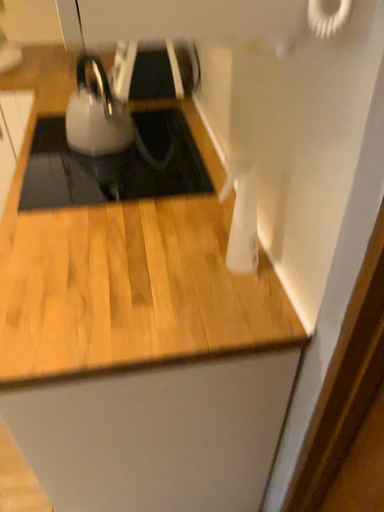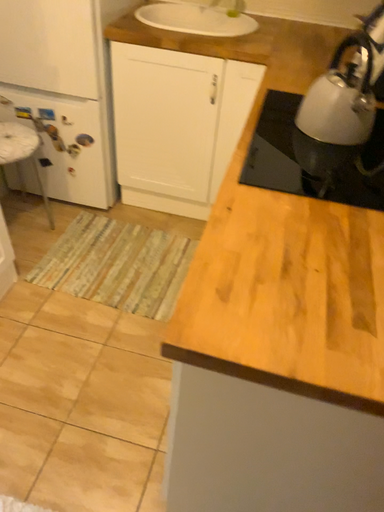
Question: How did the camera likely rotate when shooting the video?

Choices:
 (A) rotated right
 (B) rotated left

Answer: (B)